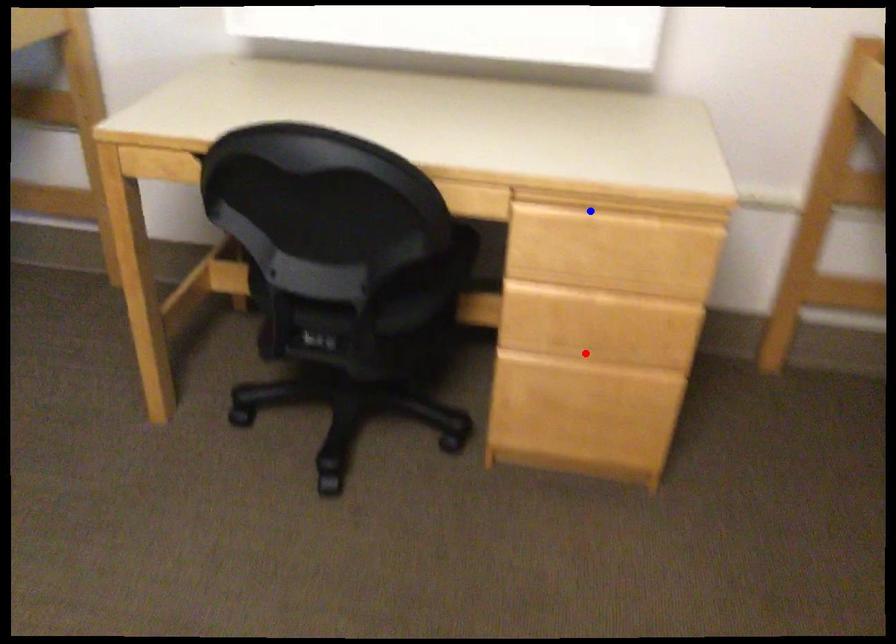
Question: Which of the two points in the image is closer to the camera?

Choices:
 (A) Blue point is closer.
 (B) Red point is closer.

Answer: (A)